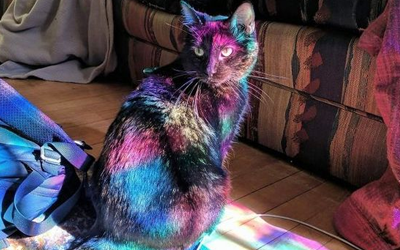
Find the location of `red blanket`. red blanket is located at coordinates (391, 41).